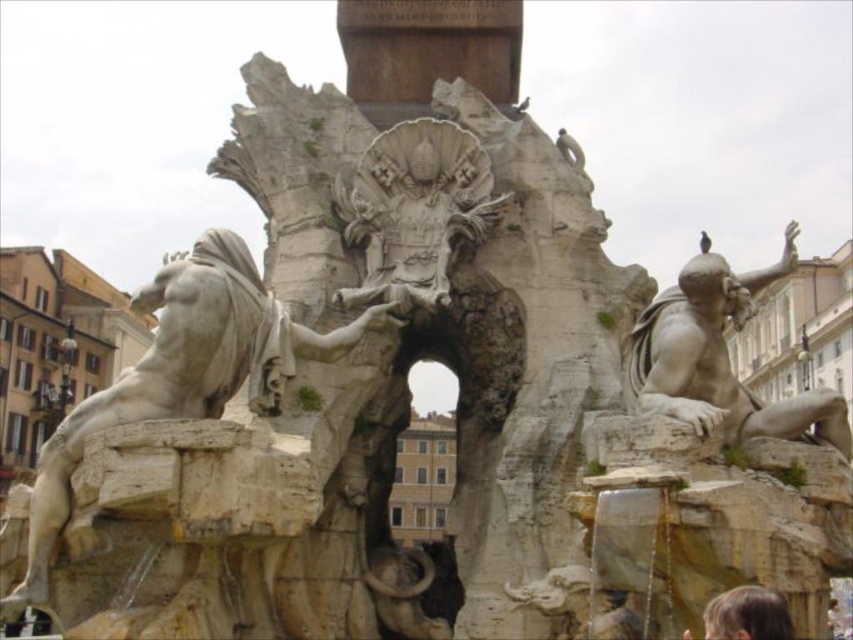
Between white marble statue at center and white stone sculpture at center, which one is positioned lower?

white marble statue at center is below.

Is white marble statue at center thinner than white stone sculpture at center?

No, white marble statue at center is not thinner than white stone sculpture at center.

Describe the element at coordinates (183, 374) in the screenshot. I see `white marble statue at center` at that location.

Where is `white marble statue at center`? The width and height of the screenshot is (853, 640). white marble statue at center is located at coordinates (183, 374).

Can you confirm if white marble statue at center is positioned to the right of matte stone figure at right?

In fact, white marble statue at center is to the left of matte stone figure at right.

Who is positioned more to the right, white marble statue at center or matte stone figure at right?

From the viewer's perspective, matte stone figure at right appears more on the right side.

The image size is (853, 640). In order to click on white marble statue at center in this screenshot , I will do `click(183, 374)`.

The image size is (853, 640). What are the coordinates of `white marble statue at center` in the screenshot? It's located at (183, 374).

Who is positioned more to the left, white stone sculpture at center or matte stone figure at right?

From the viewer's perspective, white stone sculpture at center appears more on the left side.

Is point (386, 180) farther from viewer compared to point (817, 417)?

Yes, it is.

Does point (395, 246) come farther from viewer compared to point (685, 340)?

That is True.

Where is `white stone sculpture at center`? white stone sculpture at center is located at coordinates (415, 211).